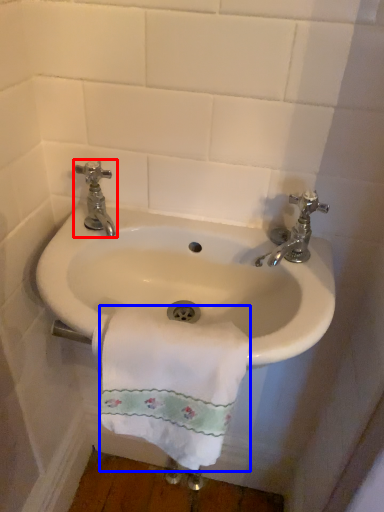
Question: Which object appears closest to the camera in this image, tap (highlighted by a red box) or towel/napkin (highlighted by a blue box)?

Choices:
 (A) tap
 (B) towel/napkin

Answer: (B)